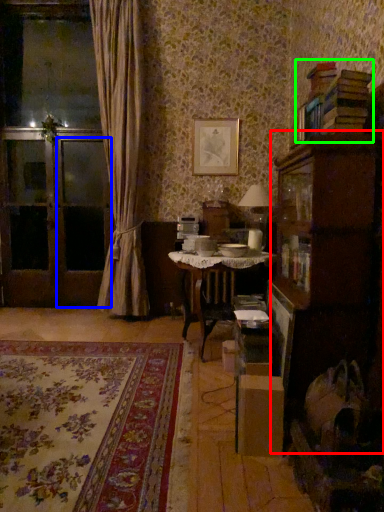
Question: Based on their relative distances, which object is nearer to cabinetry (highlighted by a red box)? Choose from screen door (highlighted by a blue box) and book (highlighted by a green box).

Choices:
 (A) screen door
 (B) book

Answer: (B)